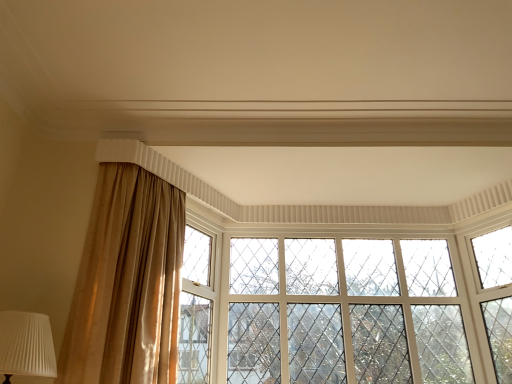
Question: Should I look upward or downward to see clear glass window at center?

Choices:
 (A) up
 (B) down

Answer: (B)

Question: Can we say white textured glass window frame at center lies outside clear glass window at center?

Choices:
 (A) no
 (B) yes

Answer: (B)

Question: Is white textured glass window frame at center to the left of clear glass window at center from the viewer's perspective?

Choices:
 (A) no
 (B) yes

Answer: (B)

Question: Considering the relative sizes of white textured glass window frame at center and clear glass window at center in the image provided, is white textured glass window frame at center smaller than clear glass window at center?

Choices:
 (A) yes
 (B) no

Answer: (A)

Question: Is white textured glass window frame at center positioned far away from clear glass window at center?

Choices:
 (A) yes
 (B) no

Answer: (B)

Question: Considering the relative sizes of white textured glass window frame at center and clear glass window at center in the image provided, is white textured glass window frame at center wider than clear glass window at center?

Choices:
 (A) no
 (B) yes

Answer: (B)

Question: Could you tell me if white textured glass window frame at center is turned towards clear glass window at center?

Choices:
 (A) no
 (B) yes

Answer: (A)

Question: Does white pleated fabric at lower left have a lesser width compared to clear glass window at center?

Choices:
 (A) yes
 (B) no

Answer: (B)

Question: Is white pleated fabric at lower left touching clear glass window at center?

Choices:
 (A) no
 (B) yes

Answer: (A)

Question: From the image's perspective, is white pleated fabric at lower left under clear glass window at center?

Choices:
 (A) yes
 (B) no

Answer: (B)

Question: Does white pleated fabric at lower left come in front of clear glass window at center?

Choices:
 (A) yes
 (B) no

Answer: (A)

Question: Considering the relative positions of white pleated fabric at lower left and clear glass window at center in the image provided, is white pleated fabric at lower left to the left of clear glass window at center from the viewer's perspective?

Choices:
 (A) yes
 (B) no

Answer: (A)

Question: From the image's perspective, does white pleated fabric at lower left appear higher than clear glass window at center?

Choices:
 (A) yes
 (B) no

Answer: (A)

Question: Does clear glass window at center have a greater width compared to white pleated fabric at lower left?

Choices:
 (A) yes
 (B) no

Answer: (B)